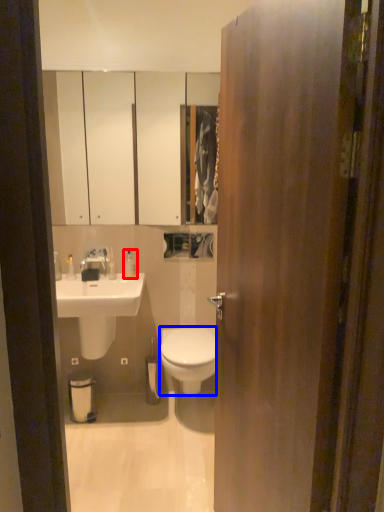
Question: Which point is further to the camera, toiletry (highlighted by a red box) or bidet (highlighted by a blue box)?

Choices:
 (A) toiletry
 (B) bidet

Answer: (A)